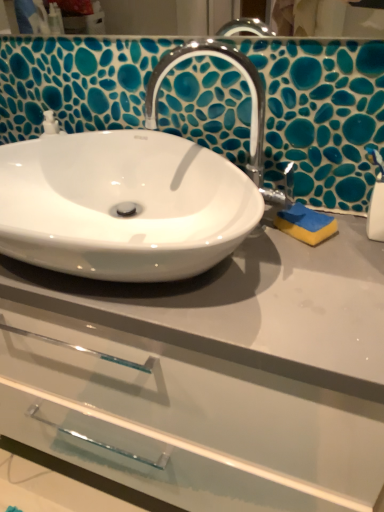
The height and width of the screenshot is (512, 384). Find the location of `vacant space situated on the left part of yellow sponge at right`. vacant space situated on the left part of yellow sponge at right is located at coordinates [247, 256].